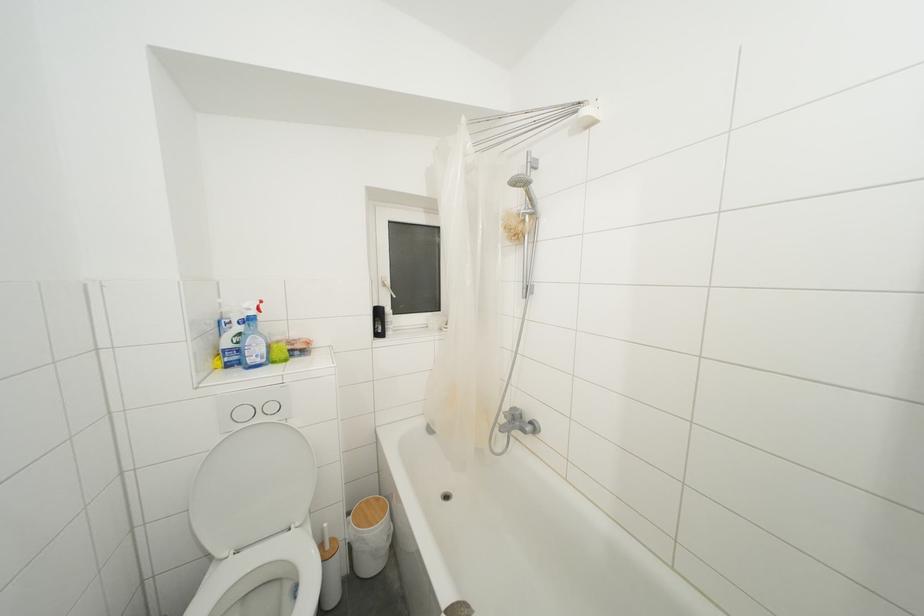
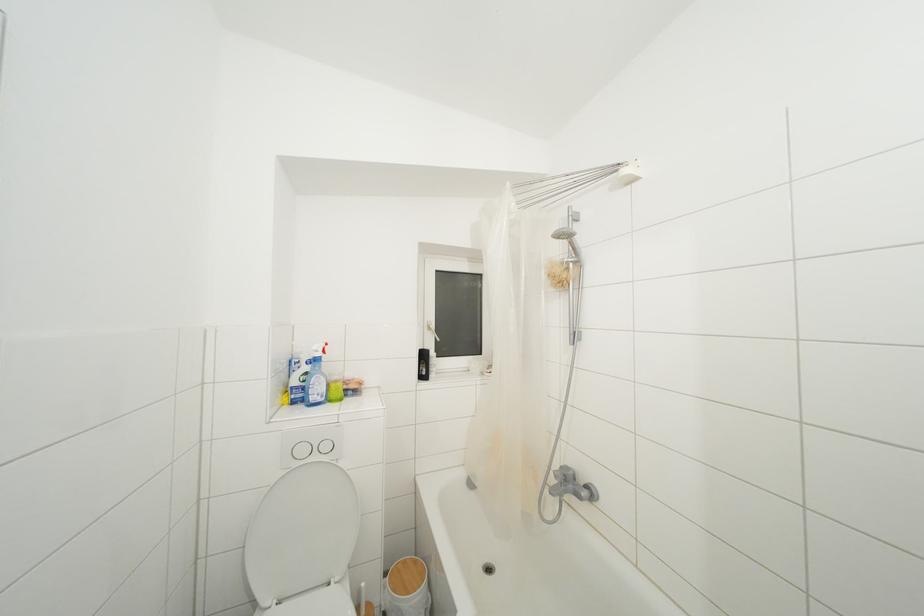
In the second image, find the point that corresponds to point (528, 225) in the first image.

(572, 273)